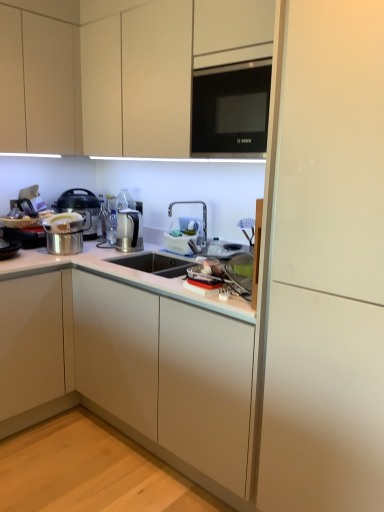
I want to click on vacant point to the right of satin silver coffee machine at center, so click(145, 252).